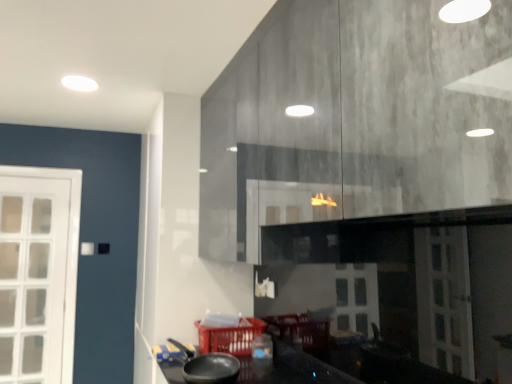
Question: Would you say matte plastic basket at lower center is to the left or to the right of black matte wok at lower center in the picture?

Choices:
 (A) left
 (B) right

Answer: (B)

Question: From a real-world perspective, is matte plastic basket at lower center positioned above or below black matte wok at lower center?

Choices:
 (A) above
 (B) below

Answer: (B)

Question: Considering the positions of point (202, 345) and point (207, 360), is point (202, 345) closer or farther from the camera than point (207, 360)?

Choices:
 (A) closer
 (B) farther

Answer: (B)

Question: Considering their positions, is black matte wok at lower center located in front of or behind matte plastic basket at lower center?

Choices:
 (A) behind
 (B) front

Answer: (B)

Question: Considering the positions of black matte wok at lower center and matte plastic basket at lower center in the image, is black matte wok at lower center wider or thinner than matte plastic basket at lower center?

Choices:
 (A) wide
 (B) thin

Answer: (B)

Question: Is point (215, 380) positioned closer to the camera than point (238, 344)?

Choices:
 (A) farther
 (B) closer

Answer: (B)

Question: From their relative heights in the image, would you say black matte wok at lower center is taller or shorter than matte plastic basket at lower center?

Choices:
 (A) tall
 (B) short

Answer: (B)